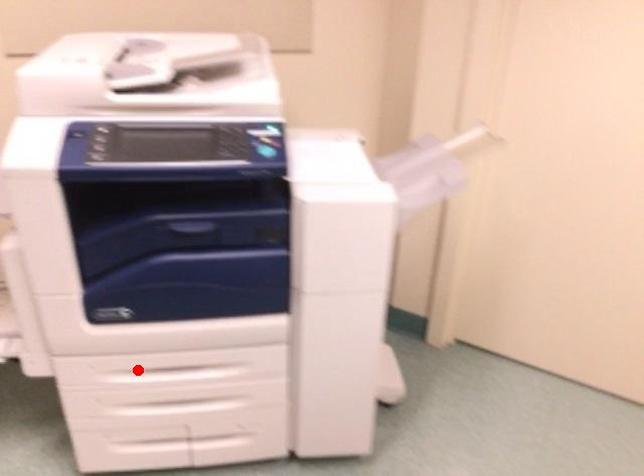
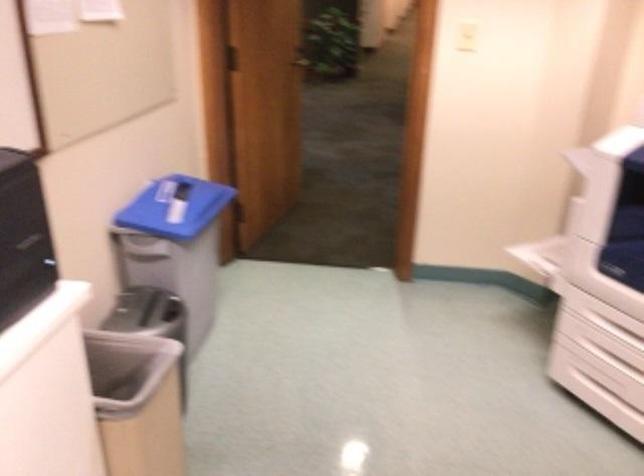
Question: I am providing you with two images of the same scene from different viewpoints. Given a red point in image1, look at the same physical point in image2. Is it:

Choices:
 (A) Closer to the viewpoint
 (B) Farther from the viewpoint

Answer: (B)